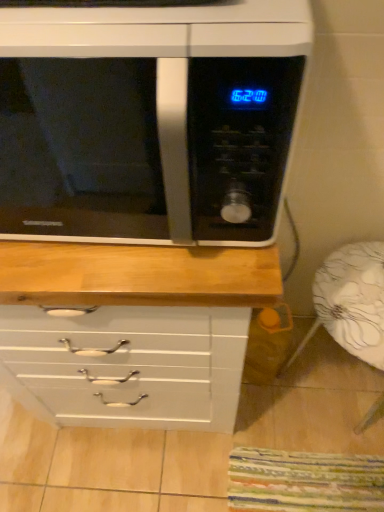
Question: Considering the relative positions of black glossy microwave at upper center and white floral fabric armchair at lower right in the image provided, is black glossy microwave at upper center to the left or to the right of white floral fabric armchair at lower right?

Choices:
 (A) right
 (B) left

Answer: (B)

Question: Looking at their shapes, would you say black glossy microwave at upper center is wider or thinner than white floral fabric armchair at lower right?

Choices:
 (A) wide
 (B) thin

Answer: (A)

Question: From the image's perspective, is black glossy microwave at upper center above or below white floral fabric armchair at lower right?

Choices:
 (A) below
 (B) above

Answer: (B)

Question: Considering the positions of white floral fabric armchair at lower right and black glossy microwave at upper center in the image, is white floral fabric armchair at lower right taller or shorter than black glossy microwave at upper center?

Choices:
 (A) short
 (B) tall

Answer: (B)

Question: In the image, is white floral fabric armchair at lower right positioned in front of or behind black glossy microwave at upper center?

Choices:
 (A) behind
 (B) front

Answer: (A)

Question: Does point (362, 418) appear closer or farther from the camera than point (96, 69)?

Choices:
 (A) closer
 (B) farther

Answer: (A)

Question: Do you think white floral fabric armchair at lower right is within black glossy microwave at upper center, or outside of it?

Choices:
 (A) outside
 (B) inside

Answer: (A)